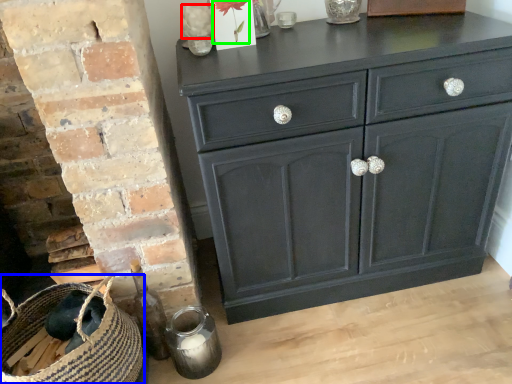
Question: Considering the real-world distances, which object is closest to flower (highlighted by a red box)? basket (highlighted by a blue box) or flower (highlighted by a green box).

Choices:
 (A) basket
 (B) flower

Answer: (B)